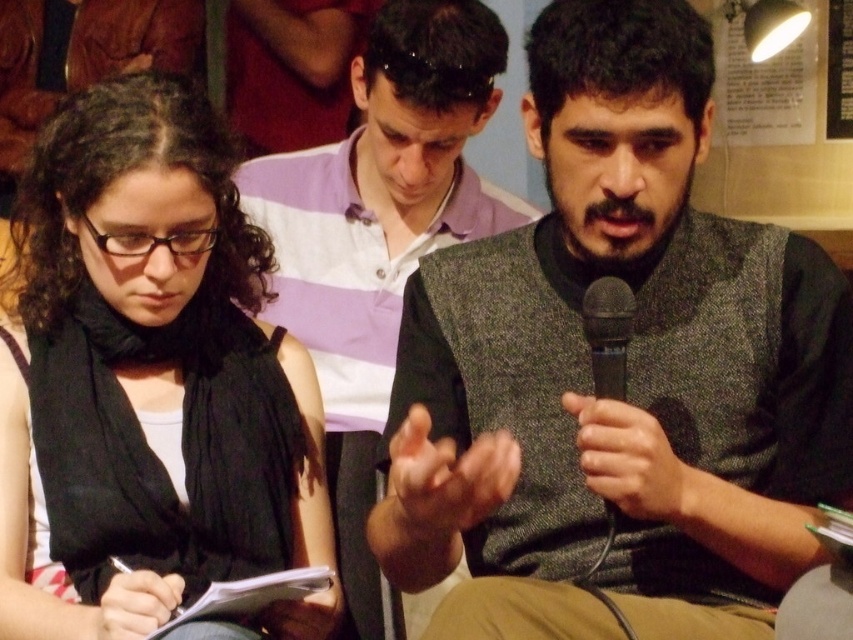
You are standing at the origin point of the coordinate system. Which of the two points, point (381, 163) or point (608, 314), is located behind the other?

Point (381, 163) is behind point (608, 314).

Based on the scene described, which object is wider when comparing the striped cotton shirt at center and the black plastic microphone at right?

The striped cotton shirt at center is wider than the black plastic microphone at right according to the description.

You are standing in the scene and want to hand a document to the person sitting at the middle ground. The document is too sensitive to leave on the table. How can you ensure the black fabric at left doesn not block your path?

Move to the right side of the black fabric at left to avoid obstruction while approaching the seated person.